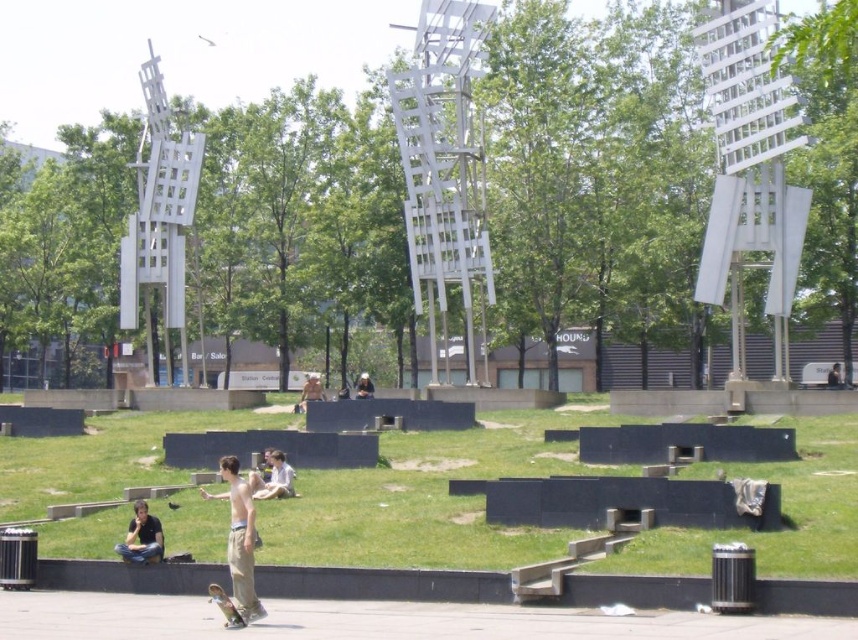
Can you confirm if matte black shirt at lower left is thinner than tan fabric jacket at center?

Indeed, matte black shirt at lower left has a lesser width compared to tan fabric jacket at center.

Is matte black shirt at lower left wider than tan fabric jacket at center?

No.

Is point (153, 525) positioned after point (306, 378)?

No, (153, 525) is closer to viewer.

Where is `matte black shirt at lower left`? The height and width of the screenshot is (640, 858). matte black shirt at lower left is located at coordinates (142, 538).

Can you confirm if wooden skateboard at lower left is thinner than dark hair person at center?

Incorrect, wooden skateboard at lower left's width is not less than dark hair person at center's.

Does wooden skateboard at lower left have a smaller size compared to dark hair person at center?

Actually, wooden skateboard at lower left might be larger than dark hair person at center.

This screenshot has height=640, width=858. Identify the location of wooden skateboard at lower left. (237, 548).

Which is more to the left, wooden skateboard at lower left or tan fabric jacket at center?

Positioned to the left is tan fabric jacket at center.

Locate an element on the screen. This screenshot has height=640, width=858. wooden skateboard at lower left is located at coordinates (237, 548).

Between point (243, 621) and point (313, 392), which one is positioned in front?

Point (243, 621)

Locate an element on the screen. wooden skateboard at lower left is located at coordinates [x=237, y=548].